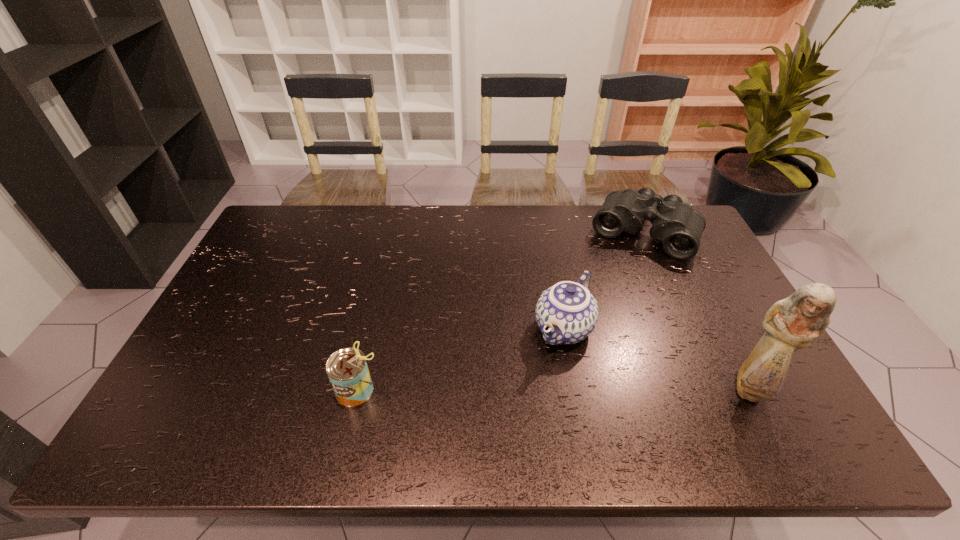
At what (x,y) coordinates should I click in order to perform the action: click on vacant space at the far edge. Please return your answer as a coordinate pair (x, y). The width and height of the screenshot is (960, 540). Looking at the image, I should click on (423, 229).

Where is `vacant space at the near edge of the desktop`? vacant space at the near edge of the desktop is located at coordinates (460, 406).

The image size is (960, 540). In the image, there is a desktop. What are the coordinates of `vacant space at the left edge` in the screenshot? It's located at coord(198,348).

This screenshot has height=540, width=960. Identify the location of vacant region at the right edge of the desktop. (733, 345).

Locate an element on the screen. Image resolution: width=960 pixels, height=540 pixels. vacant space at the far left corner is located at coordinates (282, 235).

You are a GUI agent. You are given a task and a screenshot of the screen. Output one action in this format:
    pyautogui.click(x=<x>, y=<y>)
    Task: Click on the unoccupied position between the can and the binoculars
    
    Given the screenshot: What is the action you would take?
    pos(500,312)

Where is `vacant region between the second object from left to right and the can`? The height and width of the screenshot is (540, 960). vacant region between the second object from left to right and the can is located at coordinates (461, 359).

Locate an element on the screen. The image size is (960, 540). unoccupied position between the can and the shortest object is located at coordinates (500, 312).

Where is `blank region between the figurine and the third object from right to left`? This screenshot has width=960, height=540. blank region between the figurine and the third object from right to left is located at coordinates (657, 359).

I want to click on vacant point located between the chinaware and the can, so click(461, 359).